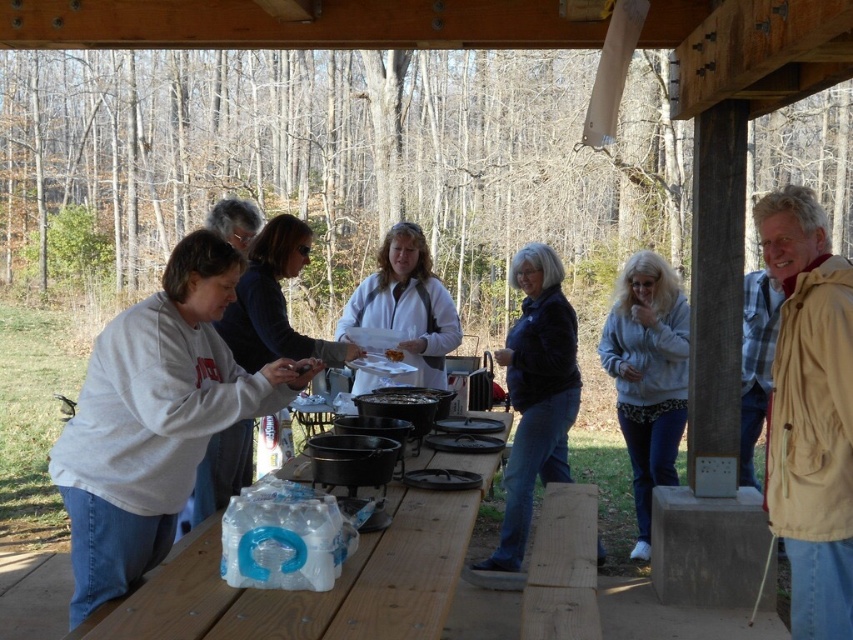
Question: Which point is closer to the camera?

Choices:
 (A) (169, 280)
 (B) (184, 564)

Answer: (B)

Question: Can you confirm if clear plastic bag at lower left is thinner than white matte jacket at center?

Choices:
 (A) no
 (B) yes

Answer: (A)

Question: Does beige fabric jacket at right appear over clear plastic bag at lower left?

Choices:
 (A) no
 (B) yes

Answer: (B)

Question: Observing the image, what is the correct spatial positioning of white matte sweatshirt at left in reference to clear plastic bag at lower left?

Choices:
 (A) below
 (B) above

Answer: (B)

Question: Among these points, which one is farthest from the camera?

Choices:
 (A) (524, 481)
 (B) (161, 317)
 (C) (399, 259)

Answer: (C)

Question: Estimate the real-world distances between objects in this image. Which object is farther from the white matte sweatshirt at left?

Choices:
 (A) white matte jacket at center
 (B) gray fleece jacket at center
 (C) dark blue jacket at center

Answer: (B)